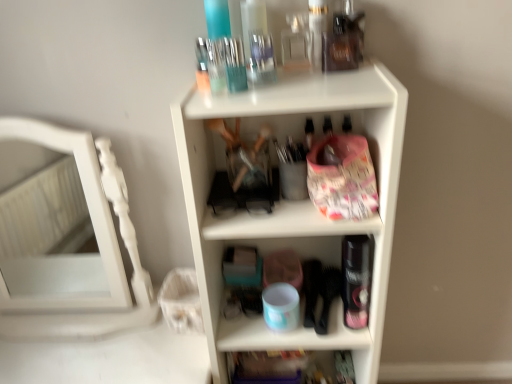
Locate an element on the screen. The width and height of the screenshot is (512, 384). translucent plastic container at lower center, the second shelf when ordered from top to bottom is located at coordinates 272,367.

What do you see at coordinates (293, 202) in the screenshot? I see `white plastic shelf at center, which is counted as the second shelf, starting from the bottom` at bounding box center [293, 202].

Measure the distance between point (287, 120) and camera.

A distance of 3.38 feet exists between point (287, 120) and camera.

Identify the location of translucent plastic container at lower center, the second shelf when ordered from top to bottom. This screenshot has width=512, height=384. (272, 367).

Considering the sizes of objects white wooden mirror at left and white plastic shelf at center, which is counted as the second shelf, starting from the bottom, in the image provided, who is bigger, white wooden mirror at left or white plastic shelf at center, which is counted as the second shelf, starting from the bottom,?

white plastic shelf at center, which is counted as the second shelf, starting from the bottom.

Consider the image. Between white wooden mirror at left and white plastic shelf at center, which is counted as the second shelf, starting from the bottom, which one has smaller width?

Thinner between the two is white wooden mirror at left.

Consider the image. Does white wooden mirror at left contain white plastic shelf at center, the first shelf from the top?

No.

Where is `the 2nd shelf to the right of the white wooden mirror at left, counting from the anchor's position`? the 2nd shelf to the right of the white wooden mirror at left, counting from the anchor's position is located at coordinates (293, 202).

Identify the location of shelf located on the right of translucent plastic container at lower center, positioned as the 1th shelf in bottom-to-top order. (293, 202).

Which of these two, white plastic shelf at center, the first shelf from the top, or translucent plastic container at lower center, the second shelf when ordered from top to bottom, stands shorter?

translucent plastic container at lower center, the second shelf when ordered from top to bottom.

How many degrees apart are the facing directions of white plastic shelf at center, which is counted as the second shelf, starting from the bottom, and translucent plastic container at lower center, the second shelf when ordered from top to bottom?

They differ by 0.00039 degrees in their facing directions.

Considering the relative sizes of white plastic shelf at center, the first shelf from the top, and translucent plastic container at lower center, positioned as the 1th shelf in bottom-to-top order, in the image provided, is white plastic shelf at center, the first shelf from the top, wider than translucent plastic container at lower center, positioned as the 1th shelf in bottom-to-top order,?

Yes, white plastic shelf at center, the first shelf from the top, is wider than translucent plastic container at lower center, positioned as the 1th shelf in bottom-to-top order.

Is white wooden mirror at left looking in the opposite direction of translucent plastic container at lower center, positioned as the 1th shelf in bottom-to-top order?

No, white wooden mirror at left's orientation is not away from translucent plastic container at lower center, positioned as the 1th shelf in bottom-to-top order.

Which is behind, white wooden mirror at left or translucent plastic container at lower center, positioned as the 1th shelf in bottom-to-top order?

translucent plastic container at lower center, positioned as the 1th shelf in bottom-to-top order, is behind.

Which of these two, white wooden mirror at left or translucent plastic container at lower center, positioned as the 1th shelf in bottom-to-top order, is thinner?

translucent plastic container at lower center, positioned as the 1th shelf in bottom-to-top order, is thinner.

Is white wooden mirror at left inside or outside of translucent plastic container at lower center, positioned as the 1th shelf in bottom-to-top order?

white wooden mirror at left is spatially situated outside translucent plastic container at lower center, positioned as the 1th shelf in bottom-to-top order.

Is white plastic shelf at center, the first shelf from the top, taller or shorter than white wooden mirror at left?

Considering their sizes, white plastic shelf at center, the first shelf from the top, has more height than white wooden mirror at left.

Who is bigger, white plastic shelf at center, which is counted as the second shelf, starting from the bottom, or white wooden mirror at left?

white plastic shelf at center, which is counted as the second shelf, starting from the bottom, is bigger.

Is point (365, 231) behind point (100, 187)?

No.

Measure the distance between white plastic shelf at center, which is counted as the second shelf, starting from the bottom, and white wooden mirror at left.

white plastic shelf at center, which is counted as the second shelf, starting from the bottom, and white wooden mirror at left are 20.51 inches apart from each other.

In the image, is translucent plastic container at lower center, the second shelf when ordered from top to bottom, on the left side or the right side of white wooden mirror at left?

translucent plastic container at lower center, the second shelf when ordered from top to bottom, is positioned on white wooden mirror at left's right side.

Considering the sizes of translucent plastic container at lower center, the second shelf when ordered from top to bottom, and white wooden mirror at left in the image, is translucent plastic container at lower center, the second shelf when ordered from top to bottom, taller or shorter than white wooden mirror at left?

translucent plastic container at lower center, the second shelf when ordered from top to bottom, is shorter than white wooden mirror at left.

From the image's perspective, is translucent plastic container at lower center, the second shelf when ordered from top to bottom, on white wooden mirror at left?

No, from the image's perspective, translucent plastic container at lower center, the second shelf when ordered from top to bottom, is not above white wooden mirror at left.

Locate an element on the screen. The width and height of the screenshot is (512, 384). the 2nd shelf directly beneath the white wooden mirror at left (from a real-world perspective) is located at coordinates (272, 367).

How far apart are translucent plastic container at lower center, the second shelf when ordered from top to bottom, and white plastic shelf at center, which is counted as the second shelf, starting from the bottom?

They are 15.58 inches apart.

Which is more to the left, translucent plastic container at lower center, positioned as the 1th shelf in bottom-to-top order, or white plastic shelf at center, which is counted as the second shelf, starting from the bottom?

translucent plastic container at lower center, positioned as the 1th shelf in bottom-to-top order.

Is white plastic shelf at center, which is counted as the second shelf, starting from the bottom, completely or partially inside translucent plastic container at lower center, positioned as the 1th shelf in bottom-to-top order?

No, white plastic shelf at center, which is counted as the second shelf, starting from the bottom, is not surrounded by translucent plastic container at lower center, positioned as the 1th shelf in bottom-to-top order.

Which of these two, translucent plastic container at lower center, positioned as the 1th shelf in bottom-to-top order, or white plastic shelf at center, which is counted as the second shelf, starting from the bottom, is bigger?

Bigger between the two is white plastic shelf at center, which is counted as the second shelf, starting from the bottom.

From a real-world perspective, which shelf is the 1st one underneath the white wooden mirror at left? Please provide its 2D coordinates.

[(293, 202)]

This screenshot has width=512, height=384. In the image, there is a translucent plastic container at lower center, the second shelf when ordered from top to bottom. Identify the location of shelf above it (from the image's perspective). (293, 202).

Estimate the real-world distances between objects in this image. Which object is closer to translucent plastic container at lower center, the second shelf when ordered from top to bottom, white plastic shelf at center, the first shelf from the top, or white wooden mirror at left?

white plastic shelf at center, the first shelf from the top.

Looking at this image, when comparing their distances from translucent plastic container at lower center, positioned as the 1th shelf in bottom-to-top order, does white wooden mirror at left or white plastic shelf at center, which is counted as the second shelf, starting from the bottom, seem closer?

Based on the image, white plastic shelf at center, which is counted as the second shelf, starting from the bottom, appears to be nearer to translucent plastic container at lower center, positioned as the 1th shelf in bottom-to-top order.

When comparing their distances from white plastic shelf at center, which is counted as the second shelf, starting from the bottom, does white wooden mirror at left or translucent plastic container at lower center, the second shelf when ordered from top to bottom, seem closer?

translucent plastic container at lower center, the second shelf when ordered from top to bottom, is positioned closer to the anchor white plastic shelf at center, which is counted as the second shelf, starting from the bottom.

Considering their positions, is translucent plastic container at lower center, the second shelf when ordered from top to bottom, positioned further to white wooden mirror at left than white plastic shelf at center, which is counted as the second shelf, starting from the bottom?

Based on the image, translucent plastic container at lower center, the second shelf when ordered from top to bottom, appears to be further to white wooden mirror at left.

Looking at the image, which one is located further to white plastic shelf at center, which is counted as the second shelf, starting from the bottom, translucent plastic container at lower center, the second shelf when ordered from top to bottom, or white wooden mirror at left?

white wooden mirror at left lies further to white plastic shelf at center, which is counted as the second shelf, starting from the bottom, than the other object.

Which object lies nearer to the anchor point white wooden mirror at left, white plastic shelf at center, the first shelf from the top, or translucent plastic container at lower center, the second shelf when ordered from top to bottom?

white plastic shelf at center, the first shelf from the top, lies closer to white wooden mirror at left than the other object.

Identify the location of shelf between white wooden mirror at left and white plastic shelf at center, the first shelf from the top, from left to right. The width and height of the screenshot is (512, 384). (272, 367).